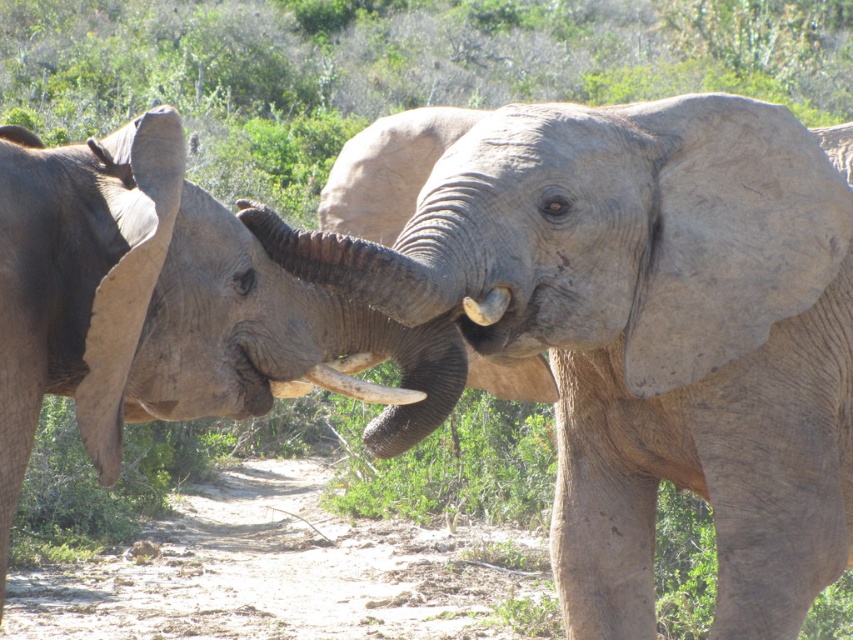
Question: Can you confirm if gray textured baby elephant at left is positioned below white ivory tusk at center?

Choices:
 (A) yes
 (B) no

Answer: (B)

Question: Which of the following is the farthest from the observer?

Choices:
 (A) gray rough skin elephant at center
 (B) gray textured baby elephant at left

Answer: (A)

Question: In this image, where is gray rough skin elephant at center located relative to gray textured baby elephant at left?

Choices:
 (A) above
 (B) below

Answer: (A)

Question: Among these objects, which one is nearest to the camera?

Choices:
 (A) gray textured baby elephant at left
 (B) gray rough skin elephant at center

Answer: (A)

Question: Does gray textured baby elephant at left have a smaller size compared to white ivory tusk at center?

Choices:
 (A) yes
 (B) no

Answer: (B)

Question: Which of these objects is positioned farthest from the gray rough skin elephant at center?

Choices:
 (A) white ivory tusk at center
 (B) gray textured baby elephant at left

Answer: (A)